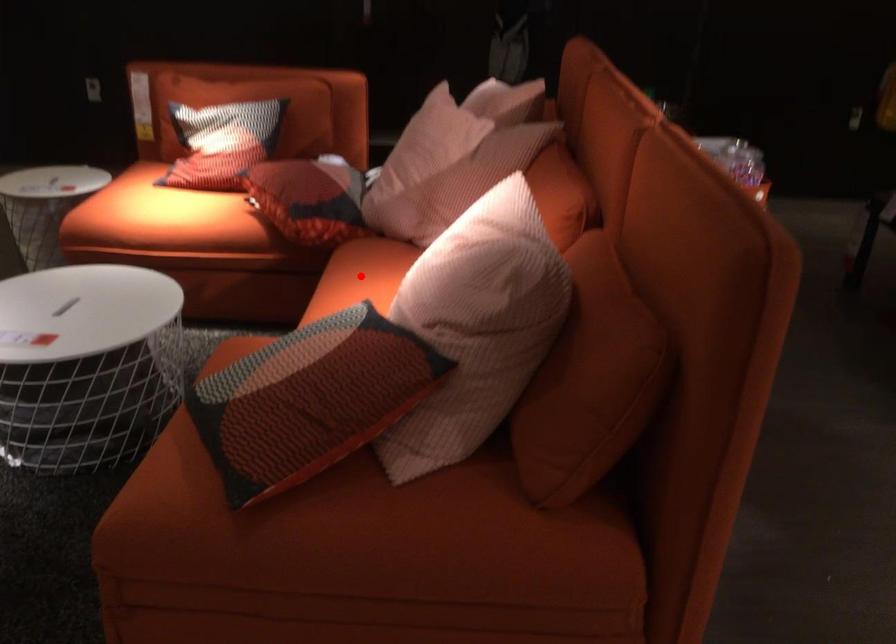
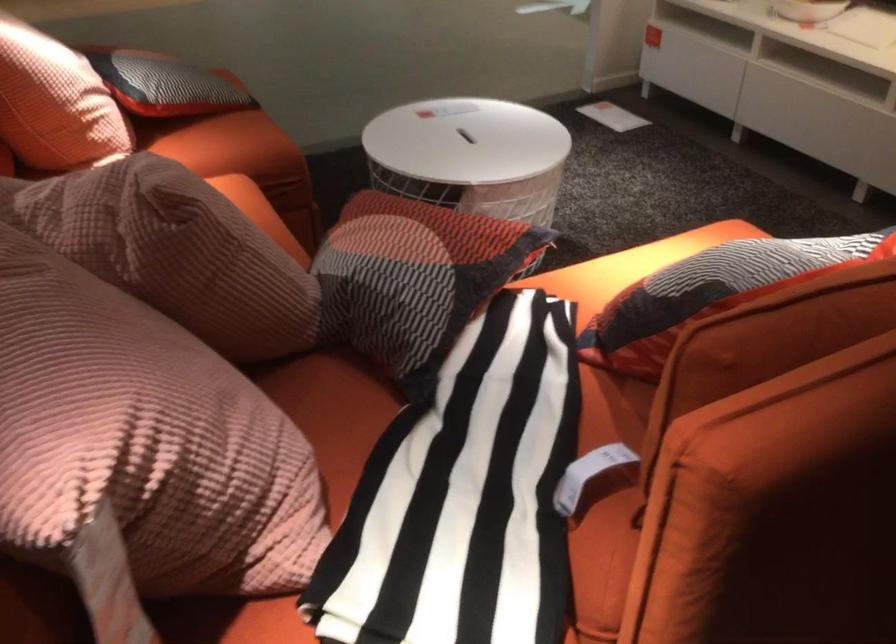
Question: I am providing you with two images of the same scene from different viewpoints. A red point is marked on the first image. At the location where the point appears in image 1, is it still visible in image 2?

Choices:
 (A) Yes
 (B) No

Answer: (B)